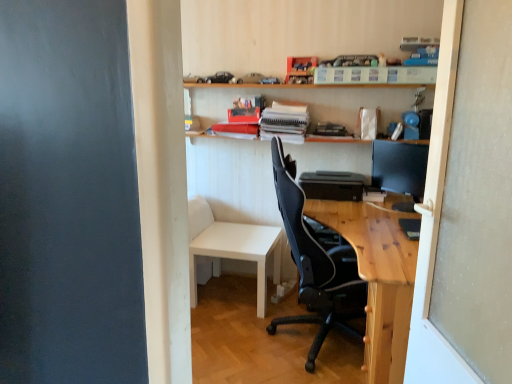
Question: From the image's perspective, is black mesh chair at center below black plastic printer at center?

Choices:
 (A) no
 (B) yes

Answer: (B)

Question: Does black mesh chair at center contain black plastic printer at center?

Choices:
 (A) no
 (B) yes

Answer: (A)

Question: Does black mesh chair at center appear on the left side of black plastic printer at center?

Choices:
 (A) no
 (B) yes

Answer: (B)

Question: Is black mesh chair at center positioned with its back to black plastic printer at center?

Choices:
 (A) yes
 (B) no

Answer: (B)

Question: Is black mesh chair at center to the right of black plastic printer at center from the viewer's perspective?

Choices:
 (A) no
 (B) yes

Answer: (A)

Question: Is black mesh chair at center far from black plastic printer at center?

Choices:
 (A) yes
 (B) no

Answer: (B)

Question: From the image's perspective, is natural wood desk at center under black glossy monitor at upper right?

Choices:
 (A) no
 (B) yes

Answer: (B)

Question: From the image's perspective, would you say natural wood desk at center is positioned over black glossy monitor at upper right?

Choices:
 (A) no
 (B) yes

Answer: (A)

Question: Can you confirm if natural wood desk at center is bigger than black glossy monitor at upper right?

Choices:
 (A) no
 (B) yes

Answer: (B)

Question: From a real-world perspective, does natural wood desk at center stand above black glossy monitor at upper right?

Choices:
 (A) no
 (B) yes

Answer: (A)

Question: Considering the relative sizes of natural wood desk at center and black glossy monitor at upper right in the image provided, is natural wood desk at center shorter than black glossy monitor at upper right?

Choices:
 (A) yes
 (B) no

Answer: (B)

Question: Is natural wood desk at center smaller than black glossy monitor at upper right?

Choices:
 (A) no
 (B) yes

Answer: (A)

Question: Is white matte table at lower center located outside wooden shelf at upper center?

Choices:
 (A) yes
 (B) no

Answer: (A)